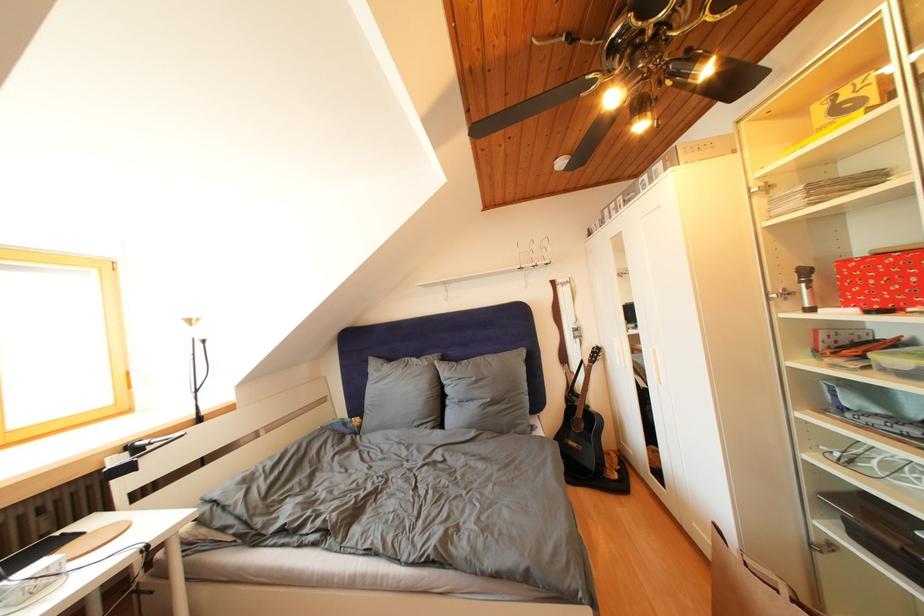
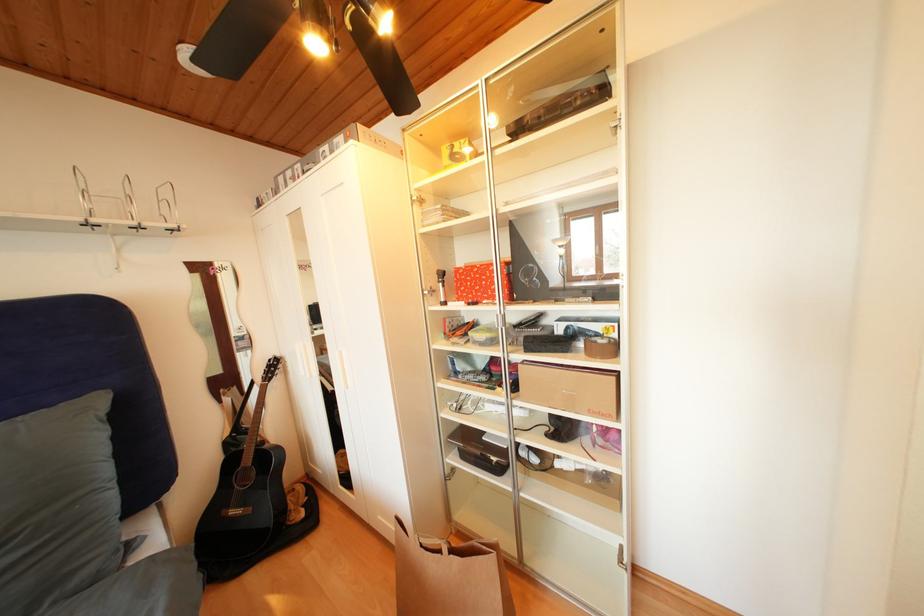
Question: How did the camera likely rotate?

Choices:
 (A) Left
 (B) Right
 (C) Up
 (D) Down

Answer: (B)